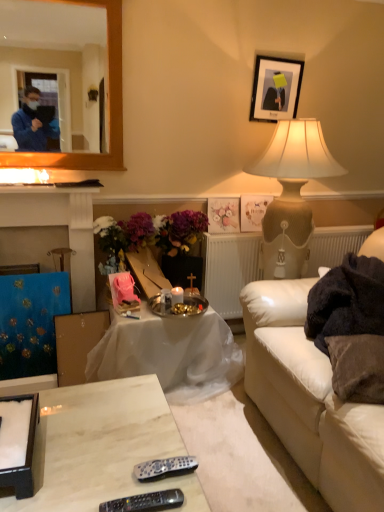
Question: Does black plastic remote at lower center, which is the 2th remote in back-to-front order, appear on the left side of matte floral picture frame at center, marked as the 1th picture frame in a bottom-to-top arrangement?

Choices:
 (A) yes
 (B) no

Answer: (A)

Question: Can you confirm if black plastic remote at lower center, which is the 2th remote in back-to-front order, is thinner than matte floral picture frame at center, marked as the 1th picture frame in a bottom-to-top arrangement?

Choices:
 (A) yes
 (B) no

Answer: (A)

Question: Is black plastic remote at lower center, which is the 2th remote in back-to-front order, not close to matte floral picture frame at center, marked as the 1th picture frame in a bottom-to-top arrangement?

Choices:
 (A) yes
 (B) no

Answer: (A)

Question: Is black plastic remote at lower center, the 1th remote viewed from the front, further to camera compared to matte floral picture frame at center, acting as the third picture frame starting from the top?

Choices:
 (A) no
 (B) yes

Answer: (A)

Question: Does black plastic remote at lower center, which is the 2th remote in back-to-front order, turn towards matte floral picture frame at center, acting as the third picture frame starting from the top?

Choices:
 (A) no
 (B) yes

Answer: (A)

Question: Is black plastic remote at lower center, the 1th remote viewed from the front, smaller than matte floral picture frame at center, marked as the 1th picture frame in a bottom-to-top arrangement?

Choices:
 (A) no
 (B) yes

Answer: (B)

Question: Considering the relative positions of silver metallic remote at lower center, the 1th remote viewed from the back, and matte black picture frame at upper center, which is counted as the 3th picture frame, starting from the bottom, in the image provided, is silver metallic remote at lower center, the 1th remote viewed from the back, in front of matte black picture frame at upper center, which is counted as the 3th picture frame, starting from the bottom,?

Choices:
 (A) no
 (B) yes

Answer: (B)

Question: Considering the relative positions of silver metallic remote at lower center, the 1th remote viewed from the back, and matte black picture frame at upper center, placed as the 1th picture frame when sorted from top to bottom, in the image provided, is silver metallic remote at lower center, the 1th remote viewed from the back, behind matte black picture frame at upper center, placed as the 1th picture frame when sorted from top to bottom,?

Choices:
 (A) no
 (B) yes

Answer: (A)

Question: Does silver metallic remote at lower center, which ranks as the second remote in front-to-back order, appear on the right side of matte black picture frame at upper center, placed as the 1th picture frame when sorted from top to bottom?

Choices:
 (A) no
 (B) yes

Answer: (A)

Question: Would you say matte black picture frame at upper center, placed as the 1th picture frame when sorted from top to bottom, is part of silver metallic remote at lower center, which ranks as the second remote in front-to-back order,'s contents?

Choices:
 (A) yes
 (B) no

Answer: (B)

Question: Is silver metallic remote at lower center, which ranks as the second remote in front-to-back order, not inside matte black picture frame at upper center, placed as the 1th picture frame when sorted from top to bottom?

Choices:
 (A) no
 (B) yes

Answer: (B)

Question: Is silver metallic remote at lower center, which ranks as the second remote in front-to-back order, oriented towards matte black picture frame at upper center, which is counted as the 3th picture frame, starting from the bottom?

Choices:
 (A) no
 (B) yes

Answer: (A)

Question: Is black plastic remote at lower center, the 1th remote viewed from the front, not close to white leather couch at lower right?

Choices:
 (A) yes
 (B) no

Answer: (B)